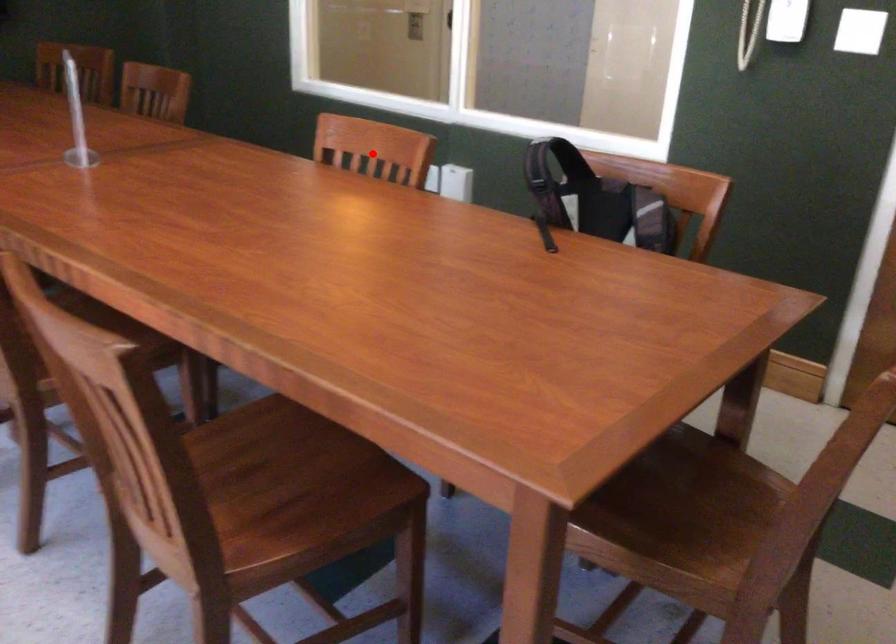
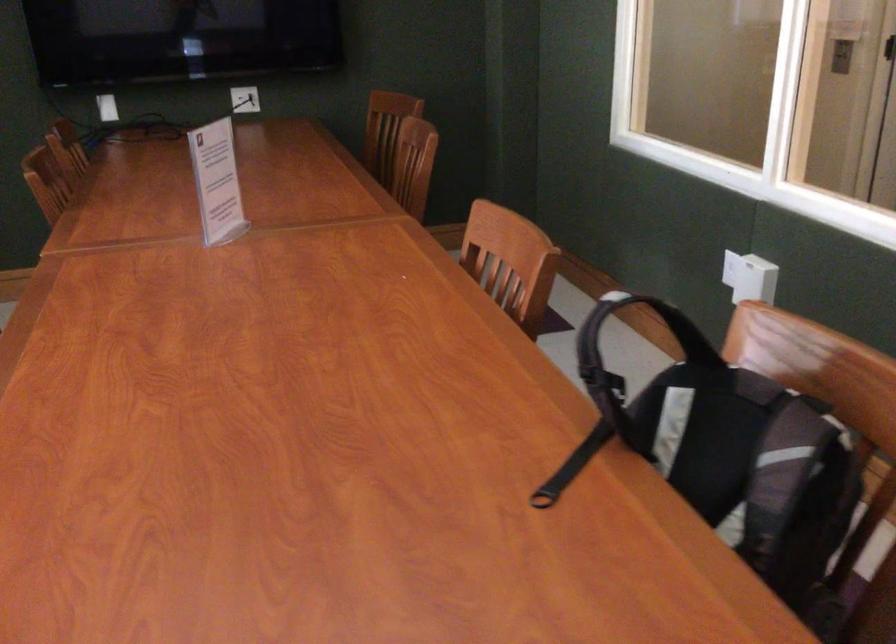
In the second image, find the point that corresponds to the highlighted location in the first image.

(510, 261)